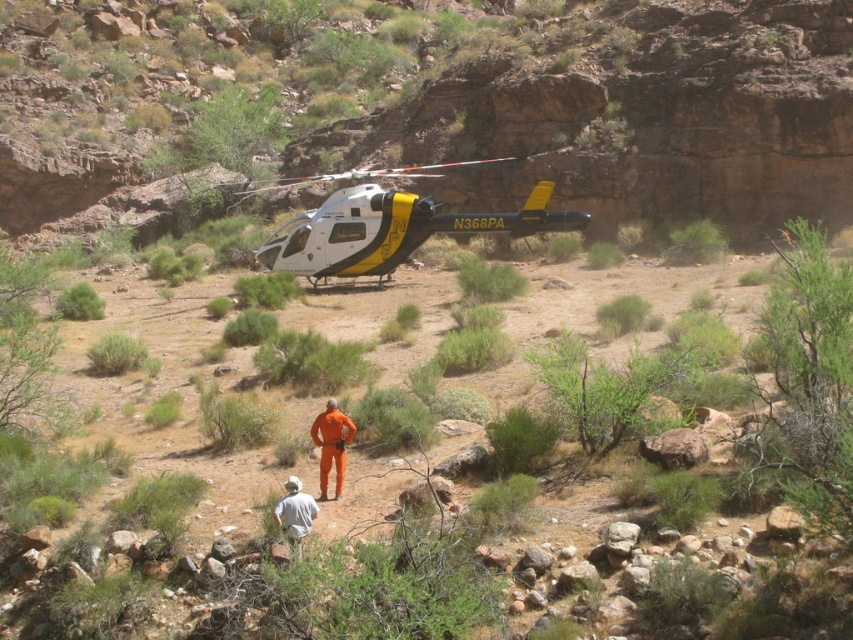
Who is more distant from viewer, (276,244) or (282,504)?

Point (276,244)

Who is shorter, white glossy helicopter at center or white fabric shirt at lower center?

With less height is white fabric shirt at lower center.

Who is more distant from viewer, [344,266] or [294,502]?

The point [344,266] is behind.

You are a GUI agent. You are given a task and a screenshot of the screen. Output one action in this format:
    pyautogui.click(x=<x>, y=<y>)
    Task: Click on the white glossy helicopter at center
    The height and width of the screenshot is (640, 853).
    Given the screenshot: What is the action you would take?
    pyautogui.click(x=390, y=230)

Does white glossy helicopter at center have a lesser height compared to orange jumpsuit at center?

No.

This screenshot has width=853, height=640. I want to click on white glossy helicopter at center, so click(x=390, y=230).

Does point (434, 52) come behind point (329, 260)?

That is True.

Is rustic stone cliff at center bigger than white glossy helicopter at center?

Yes.

Find the location of a particular element. The height and width of the screenshot is (640, 853). rustic stone cliff at center is located at coordinates (440, 104).